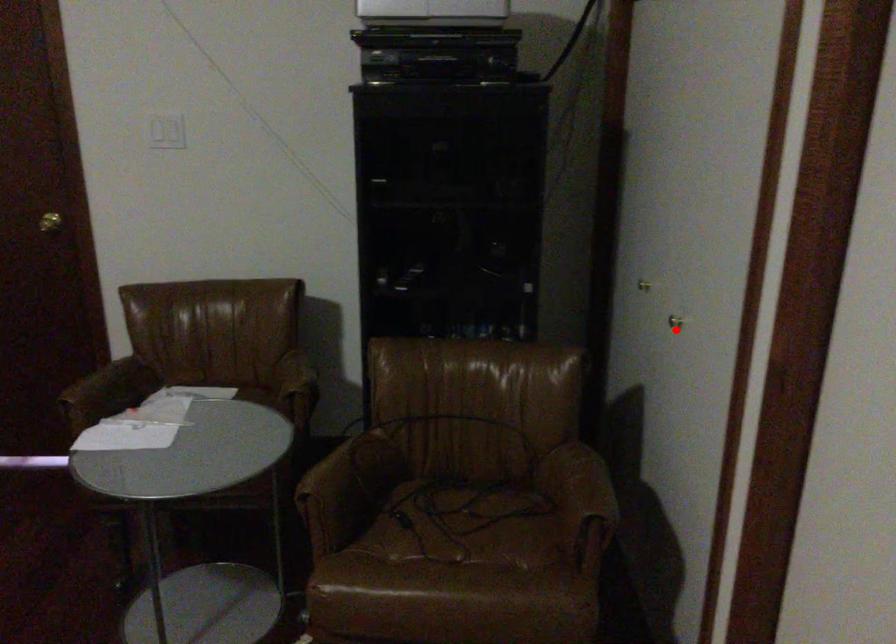
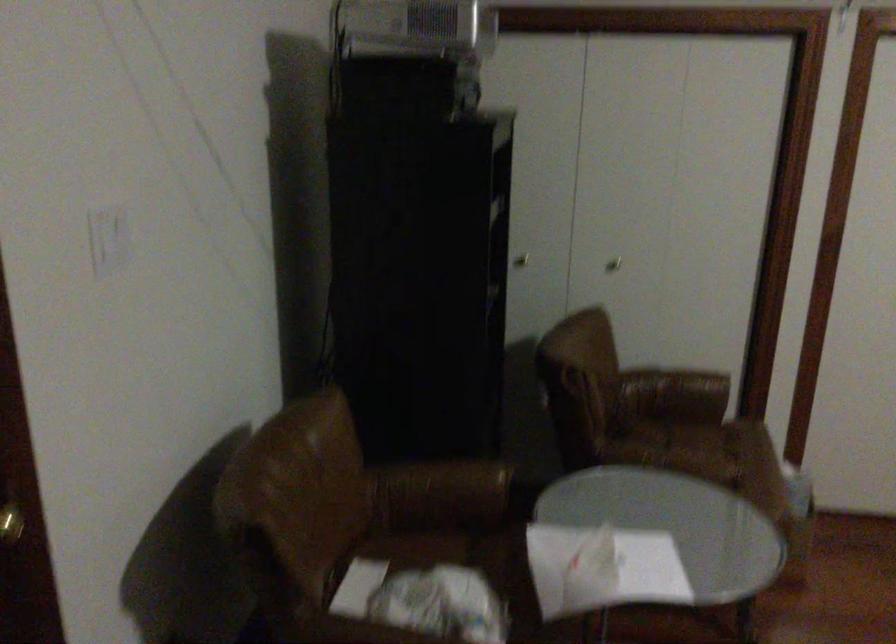
Question: I am providing you with two images of the same scene from different viewpoints. A red point is marked on the first image. Is the red point's position out of view in image 2?

Choices:
 (A) Yes
 (B) No

Answer: (B)